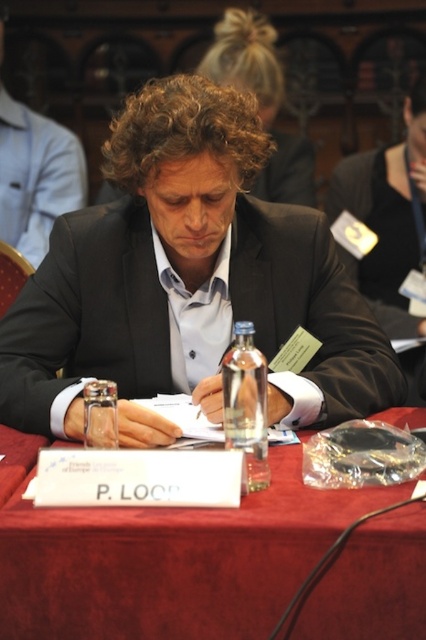
Question: Is black matte suit at center to the right of white paper at center from the viewer's perspective?

Choices:
 (A) yes
 (B) no

Answer: (A)

Question: Is red velvet table at center to the right of white paper at center from the viewer's perspective?

Choices:
 (A) yes
 (B) no

Answer: (A)

Question: Among these objects, which one is nearest to the camera?

Choices:
 (A) matte black suit at center
 (B) white paper at center

Answer: (B)

Question: Which object is farther from the camera taking this photo?

Choices:
 (A) matte black suit at center
 (B) red velvet table at center
 (C) white paper at center
 (D) black matte suit at center

Answer: (A)

Question: Where is red velvet table at center located in relation to white paper at center in the image?

Choices:
 (A) left
 (B) right

Answer: (B)

Question: Among these objects, which one is farthest from the camera?

Choices:
 (A) red velvet table at center
 (B) matte black suit at center
 (C) white paper at center

Answer: (B)